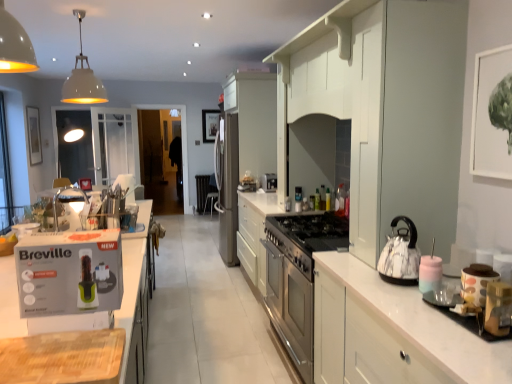
Question: Would you say white glossy cabinet at right, the first cabinetry in the front-to-back sequence, contains polka dot ceramic jar at right, acting as the second appliance starting from the front?

Choices:
 (A) no
 (B) yes

Answer: (A)

Question: Is white glossy cabinet at right, the first cabinetry in the front-to-back sequence, at the left side of polka dot ceramic jar at right, acting as the second appliance starting from the front?

Choices:
 (A) no
 (B) yes

Answer: (B)

Question: Is white glossy cabinet at right, the first cabinetry in the front-to-back sequence, positioned far away from polka dot ceramic jar at right, acting as the second appliance starting from the front?

Choices:
 (A) no
 (B) yes

Answer: (A)

Question: Can you confirm if white glossy cabinet at right, the first cabinetry in the front-to-back sequence, is bigger than polka dot ceramic jar at right, the first appliance when ordered from back to front?

Choices:
 (A) yes
 (B) no

Answer: (A)

Question: Can you confirm if white glossy cabinet at right, placed as the fourth cabinetry when sorted from back to front, is taller than polka dot ceramic jar at right, the first appliance when ordered from back to front?

Choices:
 (A) no
 (B) yes

Answer: (B)

Question: From a real-world perspective, is black fabric chair at center physically located above or below polka dot ceramic jar at right, acting as the second appliance starting from the front?

Choices:
 (A) below
 (B) above

Answer: (A)

Question: Considering the positions of black fabric chair at center and polka dot ceramic jar at right, the first appliance when ordered from back to front, in the image, is black fabric chair at center taller or shorter than polka dot ceramic jar at right, the first appliance when ordered from back to front,?

Choices:
 (A) short
 (B) tall

Answer: (B)

Question: Is black fabric chair at center inside the boundaries of polka dot ceramic jar at right, the first appliance when ordered from back to front, or outside?

Choices:
 (A) outside
 (B) inside

Answer: (A)

Question: Considering the positions of point (208, 175) and point (488, 269), is point (208, 175) closer or farther from the camera than point (488, 269)?

Choices:
 (A) farther
 (B) closer

Answer: (A)

Question: Considering the positions of metallic gold toaster at right, acting as the 2th appliance starting from the back, and translucent plastic bottle at center, the second bottle positioned from the front, in the image, is metallic gold toaster at right, acting as the 2th appliance starting from the back, taller or shorter than translucent plastic bottle at center, the second bottle positioned from the front,?

Choices:
 (A) short
 (B) tall

Answer: (A)

Question: Is point (492, 301) closer or farther from the camera than point (318, 203)?

Choices:
 (A) farther
 (B) closer

Answer: (B)

Question: Considering the positions of metallic gold toaster at right, the first appliance viewed from the front, and translucent plastic bottle at center, positioned as the 1th bottle in left-to-right order, in the image, is metallic gold toaster at right, the first appliance viewed from the front, bigger or smaller than translucent plastic bottle at center, positioned as the 1th bottle in left-to-right order,?

Choices:
 (A) small
 (B) big

Answer: (B)

Question: From a real-world perspective, is metallic gold toaster at right, the first appliance viewed from the front, positioned above or below translucent plastic bottle at center, positioned as the 1th bottle in left-to-right order?

Choices:
 (A) above
 (B) below

Answer: (B)

Question: Is point (314, 195) positioned closer to the camera than point (414, 271)?

Choices:
 (A) closer
 (B) farther

Answer: (B)

Question: From a real-world perspective, is translucent plastic bottle at center, acting as the second bottle starting from the right, above or below white marble teapot at right?

Choices:
 (A) below
 (B) above

Answer: (A)